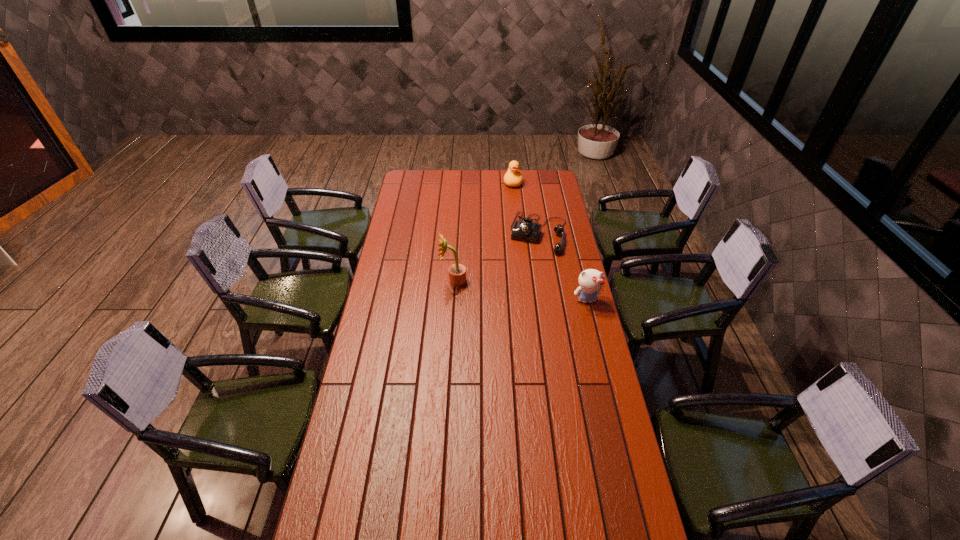
This screenshot has height=540, width=960. In order to click on free spot on the desktop that is between the tallest object and the nearest object and is positioned on the dial of the shortest object in this screenshot , I will do `click(524, 291)`.

Find the location of a particular element. This screenshot has height=540, width=960. vacant spot on the desktop that is between the second nearest object and the kitten and is positioned on the face of the third tallest object is located at coordinates (516, 290).